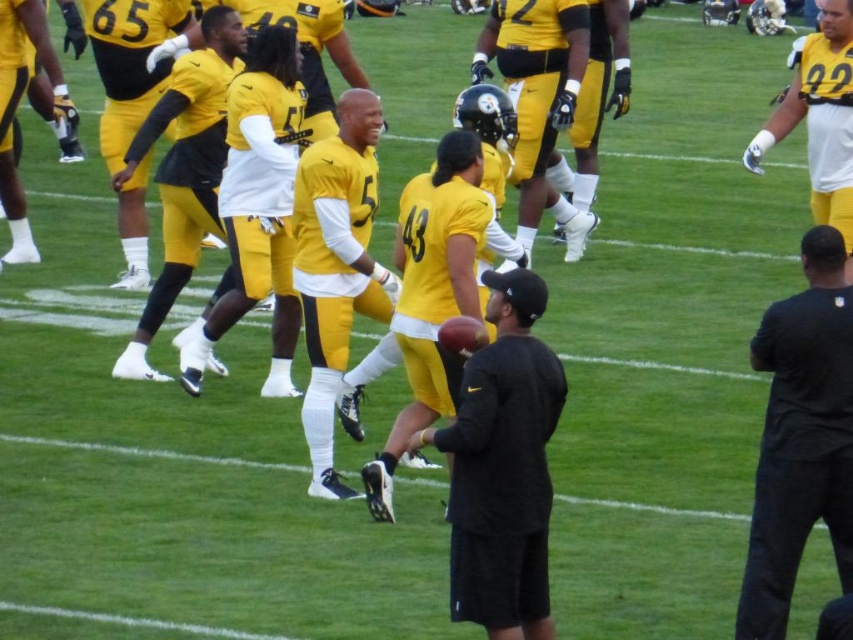
In the scene shown: You are a photographer positioned at the back of the field. You see the black matte shirt at center and the matte yellow uniform at left. Which one is closer to the camera?

The black matte shirt at center is closer to the camera because it is positioned below the matte yellow uniform at left, which means it is in front of it.

What is the location of the point labeled as point (503,467) in the football practice session image?

The point labeled as point (503,467) is on the black matte football at center.